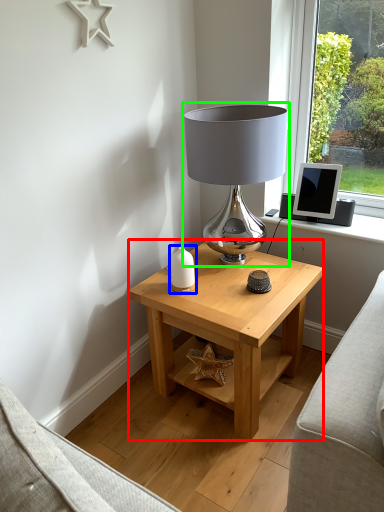
Question: Estimate the real-world distances between objects in this image. Which object is farther from table (highlighted by a red box), candle holder (highlighted by a blue box) or lamp (highlighted by a green box)?

Choices:
 (A) candle holder
 (B) lamp

Answer: (B)